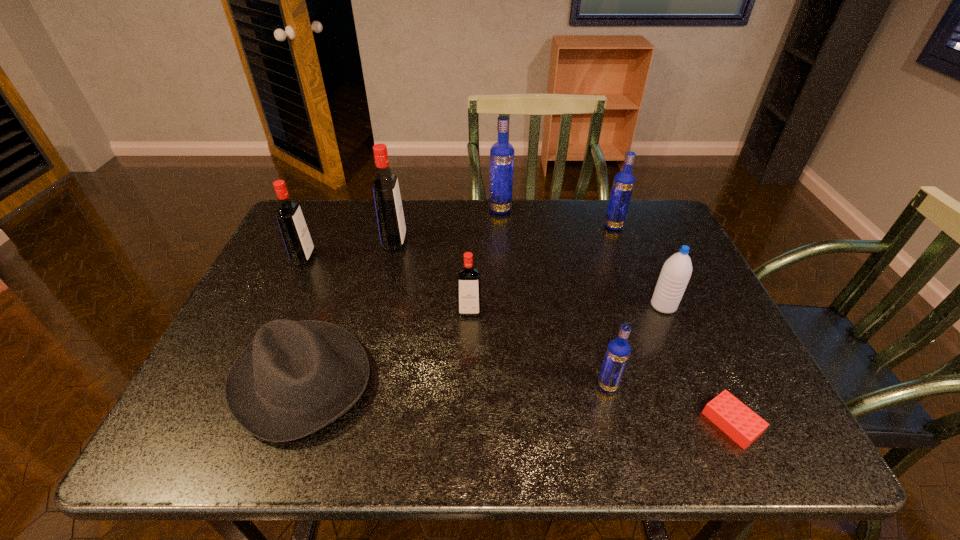
At what (x,y) coordinates should I click in order to perform the action: click on vacant space located on the left of the water bottle. Please return your answer as a coordinate pair (x, y). The width and height of the screenshot is (960, 540). Looking at the image, I should click on (493, 306).

Locate an element on the screen. The image size is (960, 540). vacant space located on the front of the second blue vodka from right to left is located at coordinates (615, 416).

Find the location of `vacant region located 0.290m on the front and back of the fourth vodka from right to left`. vacant region located 0.290m on the front and back of the fourth vodka from right to left is located at coordinates (467, 428).

Where is `vacant space located 0.370m on the back of the gray fedora`? Image resolution: width=960 pixels, height=540 pixels. vacant space located 0.370m on the back of the gray fedora is located at coordinates (353, 234).

This screenshot has height=540, width=960. Identify the location of free location located on the back of the Lego. (662, 272).

The image size is (960, 540). I want to click on fedora that is positioned at the near edge, so click(x=296, y=377).

You are a GUI agent. You are given a task and a screenshot of the screen. Output one action in this format:
    pyautogui.click(x=<x>, y=<y>)
    Task: Click on the Lego located at the near edge
    The image size is (960, 540).
    Given the screenshot: What is the action you would take?
    pyautogui.click(x=740, y=423)

This screenshot has width=960, height=540. What are the coordinates of `vodka that is at the left edge` in the screenshot? It's located at (296, 236).

Locate an element on the screen. fedora located at the left edge is located at coordinates (296, 377).

You are a GUI agent. You are given a task and a screenshot of the screen. Output one action in this format:
    pyautogui.click(x=<x>, y=<y>)
    Task: Click on the vodka located at the right edge
    This screenshot has width=960, height=540.
    Given the screenshot: What is the action you would take?
    pyautogui.click(x=623, y=183)